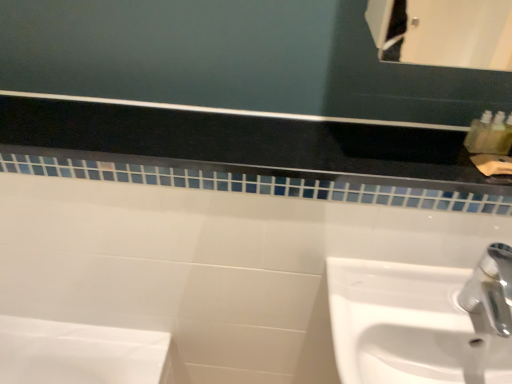
This screenshot has width=512, height=384. Describe the element at coordinates (242, 144) in the screenshot. I see `white glossy tile at upper center` at that location.

In order to click on white glossy tile at upper center in this screenshot , I will do `click(242, 144)`.

You are a GUI agent. You are given a task and a screenshot of the screen. Output one action in this format:
    pyautogui.click(x=<x>, y=<y>)
    Task: Click on the white glossy sink at lower right
    
    Given the screenshot: What is the action you would take?
    pyautogui.click(x=421, y=321)

What do you see at coordinates (421, 321) in the screenshot? The width and height of the screenshot is (512, 384). I see `white glossy sink at lower right` at bounding box center [421, 321].

In order to face white glossy sink at lower right, should I rotate leftwards or rightwards?

It's best to rotate right around 23.516 degrees.

What are the coordinates of `white glossy tile at upper center` in the screenshot? It's located at (242, 144).

Would you say white glossy tile at upper center is to the left or to the right of white glossy sink at lower right in the picture?

white glossy tile at upper center is to the left of white glossy sink at lower right.

Is white glossy tile at upper center in front of or behind white glossy sink at lower right in the image?

white glossy tile at upper center is behind white glossy sink at lower right.

Which is more distant, (x=306, y=174) or (x=345, y=381)?

The point (x=306, y=174) is behind.

From the image's perspective, relative to white glossy sink at lower right, is white glossy tile at upper center above or below?

Clearly, from the image's perspective, white glossy tile at upper center is above white glossy sink at lower right.

From a real-world perspective, does white glossy tile at upper center stand above white glossy sink at lower right?

Yes, from a real-world perspective, white glossy tile at upper center is above white glossy sink at lower right.

Can you confirm if white glossy tile at upper center is wider than white glossy sink at lower right?

No.

Can you confirm if white glossy tile at upper center is taller than white glossy sink at lower right?

In fact, white glossy tile at upper center may be shorter than white glossy sink at lower right.

Considering the sizes of objects white glossy tile at upper center and white glossy sink at lower right in the image provided, who is smaller, white glossy tile at upper center or white glossy sink at lower right?

With smaller size is white glossy tile at upper center.

Is white glossy tile at upper center surrounding white glossy sink at lower right?

That's incorrect, white glossy sink at lower right is not inside white glossy tile at upper center.

From the picture: Are white glossy tile at upper center and white glossy sink at lower right located far from each other?

They are positioned close to each other.

Is white glossy sink at lower right at the back of white glossy tile at upper center?

No, white glossy tile at upper center's orientation is not away from white glossy sink at lower right.

What's the angular difference between white glossy tile at upper center and white glossy sink at lower right's facing directions?

The facing directions of white glossy tile at upper center and white glossy sink at lower right are 0.276 degrees apart.

Measure the distance from white glossy tile at upper center to white glossy sink at lower right.

white glossy tile at upper center and white glossy sink at lower right are 29.33 centimeters apart.

You are a GUI agent. You are given a task and a screenshot of the screen. Output one action in this format:
    pyautogui.click(x=<x>, y=<y>)
    Task: Click on the sink located below the white glossy tile at upper center (from the image's perspective)
    
    Given the screenshot: What is the action you would take?
    pyautogui.click(x=421, y=321)

Can you confirm if white glossy sink at lower right is positioned to the right of white glossy tile at upper center?

Yes, white glossy sink at lower right is to the right of white glossy tile at upper center.

Considering the positions of objects white glossy sink at lower right and white glossy tile at upper center in the image provided, who is in front, white glossy sink at lower right or white glossy tile at upper center?

white glossy sink at lower right is in front.

From the picture: Which is more distant, (x=341, y=370) or (x=165, y=146)?

The point (x=165, y=146) is farther.

From the image's perspective, would you say white glossy sink at lower right is shown under white glossy tile at upper center?

Yes, from the image's perspective, white glossy sink at lower right is below white glossy tile at upper center.

From a real-world perspective, is white glossy sink at lower right physically above white glossy tile at upper center?

No, from a real-world perspective, white glossy sink at lower right is not over white glossy tile at upper center

In terms of width, does white glossy sink at lower right look wider or thinner when compared to white glossy tile at upper center?

white glossy sink at lower right is wider than white glossy tile at upper center.

Between white glossy sink at lower right and white glossy tile at upper center, which one has less height?

white glossy tile at upper center is shorter.

Which of these two, white glossy sink at lower right or white glossy tile at upper center, is bigger?

With larger size is white glossy sink at lower right.

Can white glossy tile at upper center be found inside white glossy sink at lower right?

No.

Can you see white glossy sink at lower right touching white glossy tile at upper center?

No, white glossy sink at lower right is not beside white glossy tile at upper center.

Is white glossy sink at lower right oriented towards white glossy tile at upper center?

No, white glossy sink at lower right is not oriented towards white glossy tile at upper center.

The height and width of the screenshot is (384, 512). I want to click on sink below the white glossy tile at upper center (from the image's perspective), so click(x=421, y=321).

In order to click on sink below the white glossy tile at upper center (from a real-world perspective) in this screenshot , I will do `click(421, 321)`.

Identify the location of balustrade on the left of the white glossy sink at lower right. (242, 144).